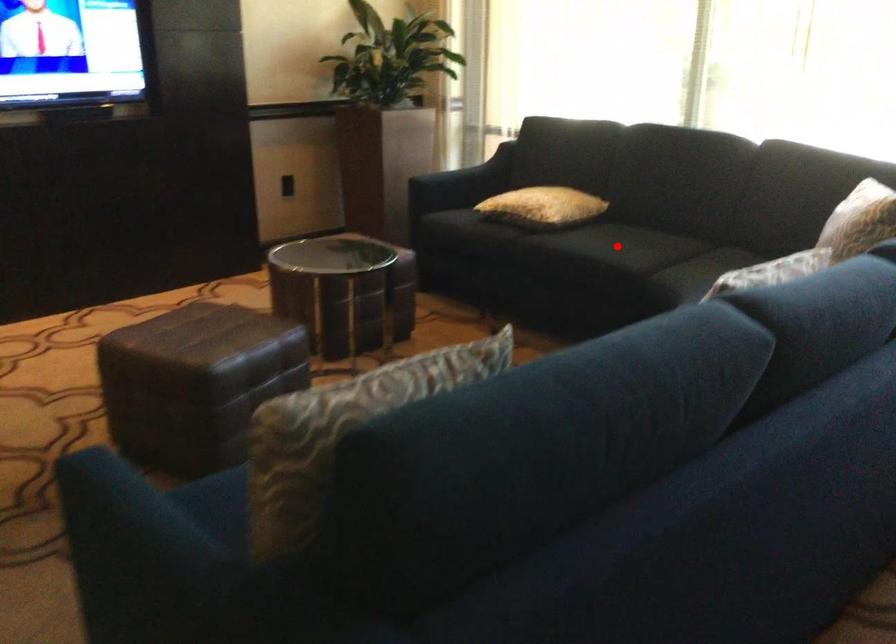
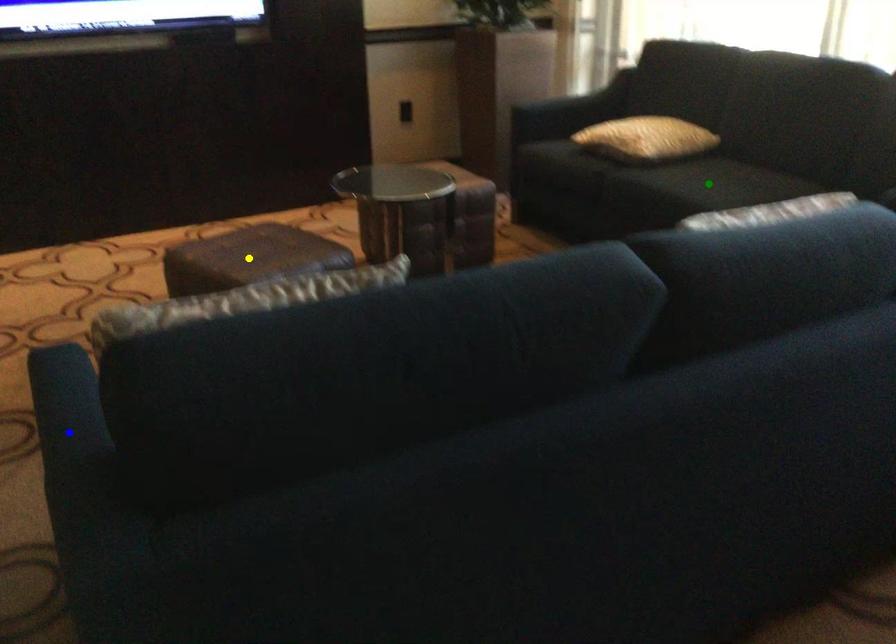
Question: I am providing you with two images of the same scene from different viewpoints. A red point is marked on the first image. You are given multiple points on the second image. In image 2, which mark is for the same physical point as the one in image 1?

Choices:
 (A) green point
 (B) yellow point
 (C) blue point

Answer: (A)